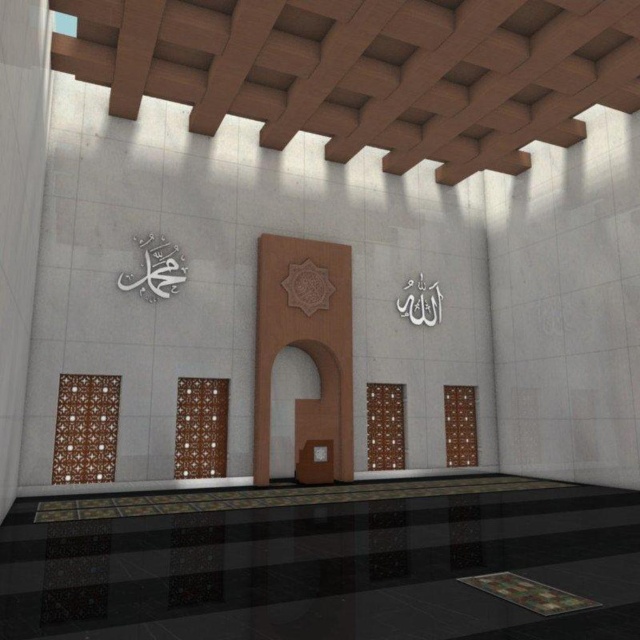
Which is below, white metallic calligraphy at upper left or white paper at upper right?

Positioned lower is white paper at upper right.

Is point (177, 266) closer to camera compared to point (420, 301)?

Yes, point (177, 266) is in front of point (420, 301).

Is point (150, 259) positioned behind point (428, 300)?

That is False.

The image size is (640, 640). In order to click on white metallic calligraphy at upper left in this screenshot , I will do `click(156, 269)`.

Between white metallic calligraphy at upper left and brown textured tile at center, which one appears on the left side from the viewer's perspective?

From the viewer's perspective, white metallic calligraphy at upper left appears more on the left side.

Looking at this image, can you confirm if white metallic calligraphy at upper left is wider than brown textured tile at center?

Correct, the width of white metallic calligraphy at upper left exceeds that of brown textured tile at center.

Who is more distant from viewer, (170, 244) or (289, 294)?

The point (289, 294) is more distant.

Locate an element on the screen. white metallic calligraphy at upper left is located at coordinates (156, 269).

Between brown wooden archway at center and white paper at upper right, which one has more height?

brown wooden archway at center

Is the position of brown wooden archway at center more distant than that of white paper at upper right?

No, brown wooden archway at center is closer to the viewer.

Does point (317, 401) lie in front of point (410, 289)?

Yes.

Where is `brown wooden archway at center`? Image resolution: width=640 pixels, height=640 pixels. brown wooden archway at center is located at coordinates (301, 406).